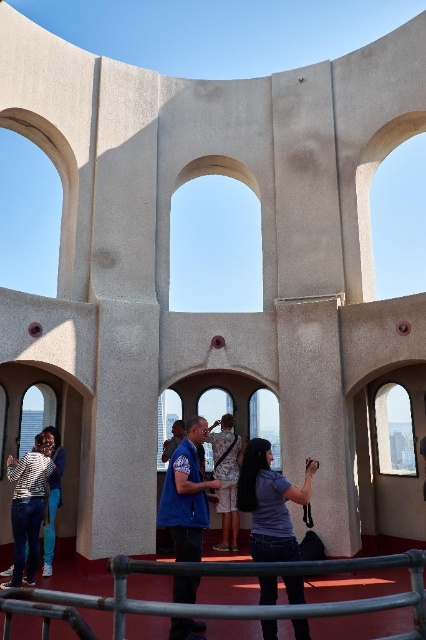
Question: Can you confirm if metallic gray railing at lower center is thinner than striped cotton shirt at lower left?

Choices:
 (A) no
 (B) yes

Answer: (A)

Question: Which object is closer to the camera taking this photo?

Choices:
 (A) blue fabric shirt at center
 (B) matte blue shirt at center
 (C) camouflage-patterned dress at center
 (D) metallic gray railing at lower center

Answer: (D)

Question: Is metallic gray railing at lower center closer to the viewer compared to camouflage-patterned dress at center?

Choices:
 (A) no
 (B) yes

Answer: (B)

Question: Is matte blue shirt at center to the left of striped cotton shirt at lower left from the viewer's perspective?

Choices:
 (A) yes
 (B) no

Answer: (B)

Question: Which object is positioned farthest from the camouflage-patterned dress at center?

Choices:
 (A) blue fabric shirt at center
 (B) metallic gray railing at lower center
 (C) matte blue shirt at center
 (D) striped cotton shirt at lower left

Answer: (B)

Question: Among these objects, which one is farthest from the camera?

Choices:
 (A) striped cotton shirt at lower left
 (B) blue fabric shirt at center
 (C) camouflage-patterned dress at center
 (D) matte blue shirt at center

Answer: (C)